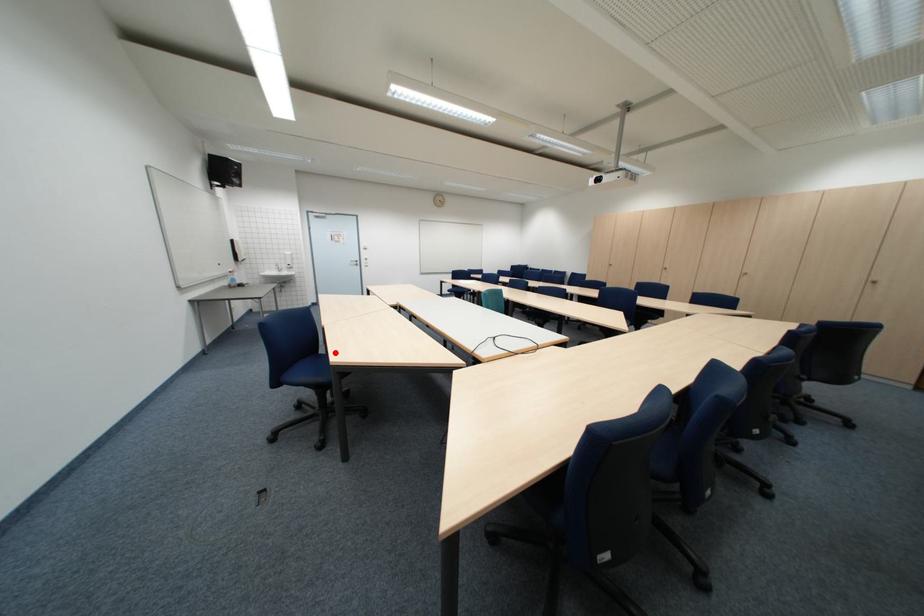
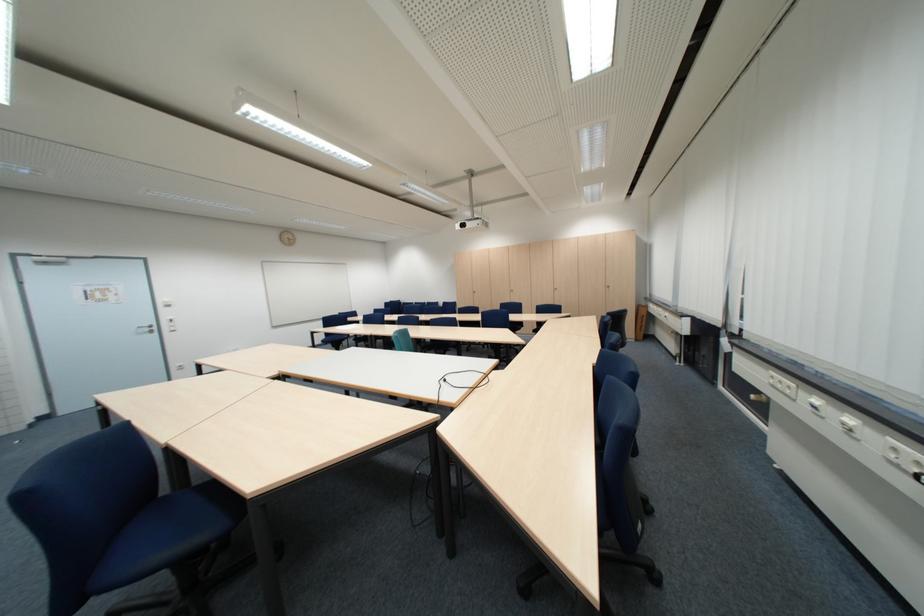
Question: I am providing you with two images of the same scene from different viewpoints. Image1 has a red point marked. In image2, the corresponding 3D location appears at what relative position? Reply with the corresponding letter.

Choices:
 (A) Closer
 (B) Farther

Answer: (A)